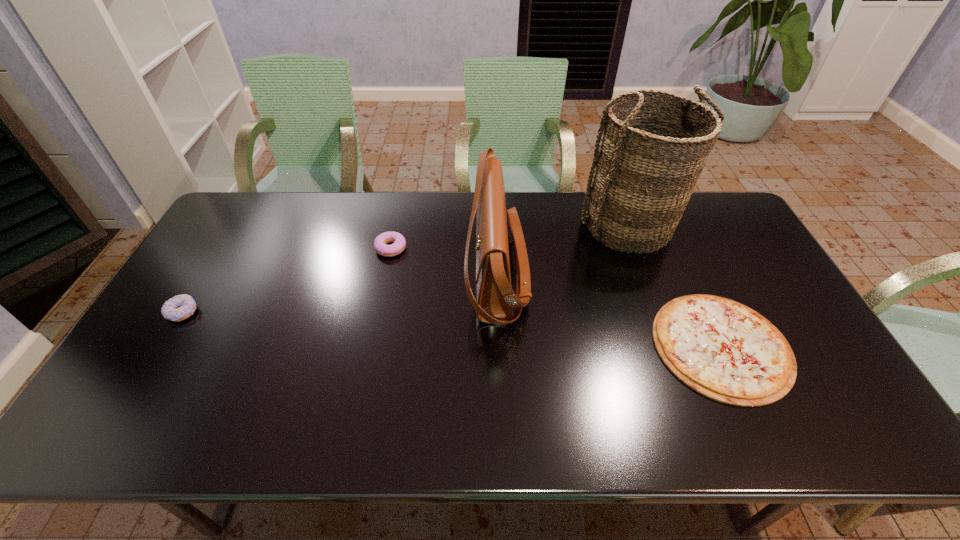
Image resolution: width=960 pixels, height=540 pixels. What are the coordinates of `free space located 0.110m on the front flap of the second tallest object` in the screenshot? It's located at (430, 274).

At what (x,y) coordinates should I click in order to perform the action: click on vacant position located on the front flap of the second tallest object. Please return your answer as a coordinate pair (x, y). Looking at the image, I should click on (417, 274).

Identify the location of free space located on the front of the farther doughnut. This screenshot has width=960, height=540. pyautogui.click(x=381, y=292).

You are a GUI agent. You are given a task and a screenshot of the screen. Output one action in this format:
    pyautogui.click(x=<x>, y=<y>)
    Task: Click on the free point located 0.290m on the back of the left doughnut
    The height and width of the screenshot is (540, 960).
    Given the screenshot: What is the action you would take?
    pyautogui.click(x=229, y=235)

Where is `vacant space located 0.190m on the left of the pizza`? The width and height of the screenshot is (960, 540). vacant space located 0.190m on the left of the pizza is located at coordinates (582, 346).

Where is `basket that is at the far edge`? basket that is at the far edge is located at coordinates (642, 177).

Where is `satchel located at the far edge`? Image resolution: width=960 pixels, height=540 pixels. satchel located at the far edge is located at coordinates (495, 301).

Locate an element on the screen. This screenshot has width=960, height=540. object located in the left edge section of the desktop is located at coordinates (180, 307).

What are the coordinates of `object that is at the right edge` in the screenshot? It's located at (722, 349).

What are the coordinates of `vacant space at the far edge of the desktop` in the screenshot? It's located at (561, 220).